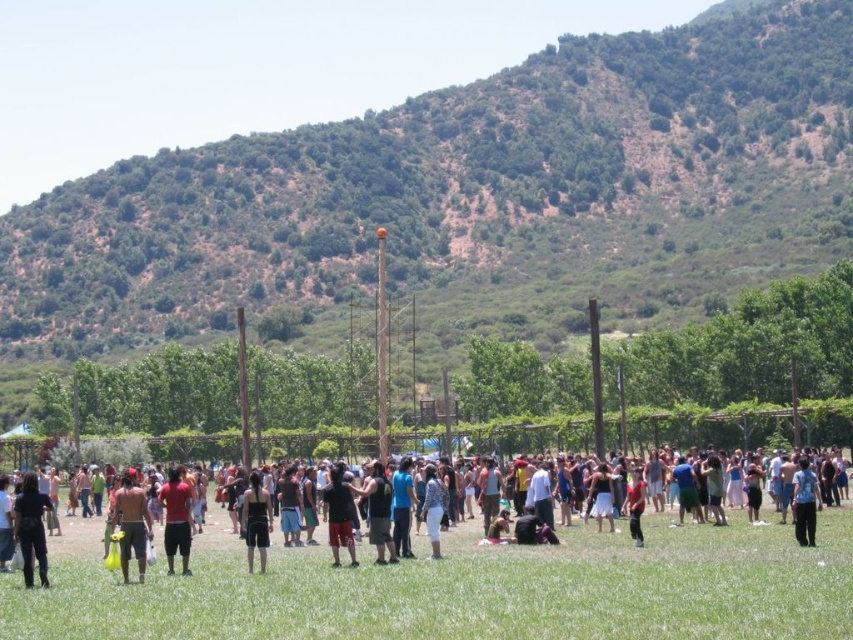
Question: Which point is closer to the camera?

Choices:
 (A) (263, 488)
 (B) (373, 508)
 (C) (793, 497)

Answer: (B)

Question: Does shiny metallic shorts at center appear over matte red shirt at center?

Choices:
 (A) yes
 (B) no

Answer: (A)

Question: Can you confirm if shiny metallic shorts at center is positioned below black tank top at center?

Choices:
 (A) yes
 (B) no

Answer: (B)

Question: Which point is farther from the camera taking this photo?

Choices:
 (A) (247, 547)
 (B) (329, 477)
 (C) (392, 556)
 (D) (158, 596)

Answer: (B)

Question: Which of the following is the closest to the observer?

Choices:
 (A) matte red shorts at center
 (B) black matte shorts at center
 (C) shiny metallic shorts at center
 (D) black matte pants at lower left

Answer: (D)

Question: Can you confirm if black matte shorts at center is positioned above white cotton pants at center?

Choices:
 (A) yes
 (B) no

Answer: (A)